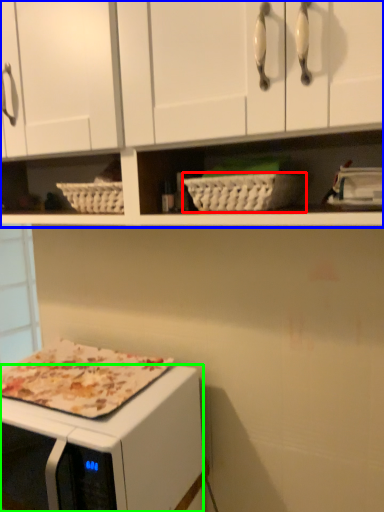
Question: Considering the real-world distances, which object is farthest from basket (highlighted by a red box)? cabinetry (highlighted by a blue box) or microwave oven (highlighted by a green box)?

Choices:
 (A) cabinetry
 (B) microwave oven

Answer: (B)